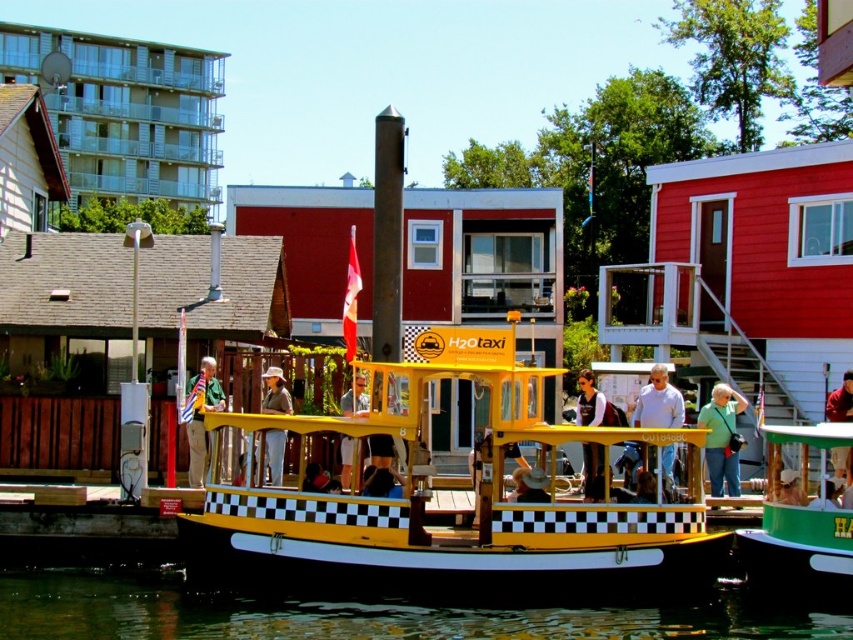
Question: Is transparent water at lower center above green matte boat at center?

Choices:
 (A) yes
 (B) no

Answer: (B)

Question: Which is nearer to the khaki fabric hat at center?

Choices:
 (A) matte black jacket at center
 (B) transparent water at lower center

Answer: (B)

Question: From the image, what is the correct spatial relationship of green matte boat at center in relation to green fabric shirt at center?

Choices:
 (A) below
 (B) above

Answer: (B)

Question: Based on their relative distances, which object is farther from the green fabric shirt at center?

Choices:
 (A) matte black jacket at center
 (B) yellow matte boat at center
 (C) transparent water at lower center

Answer: (A)

Question: Which of the following is the farthest from the observer?

Choices:
 (A) yellow matte taxi boat at center
 (B) yellow matte boat at center
 (C) transparent water at lower center

Answer: (B)

Question: Does transparent water at lower center lie behind green fabric shirt at center?

Choices:
 (A) no
 (B) yes

Answer: (A)